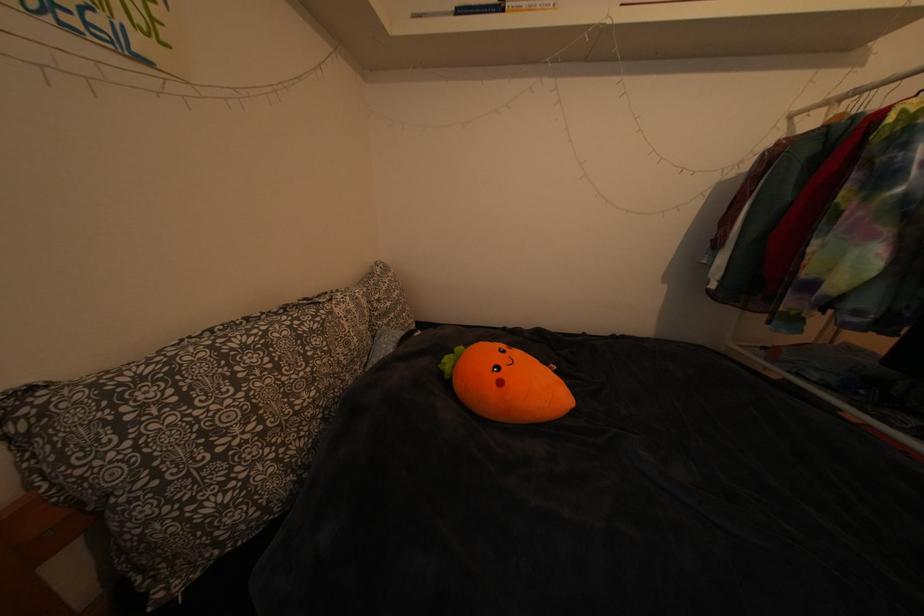
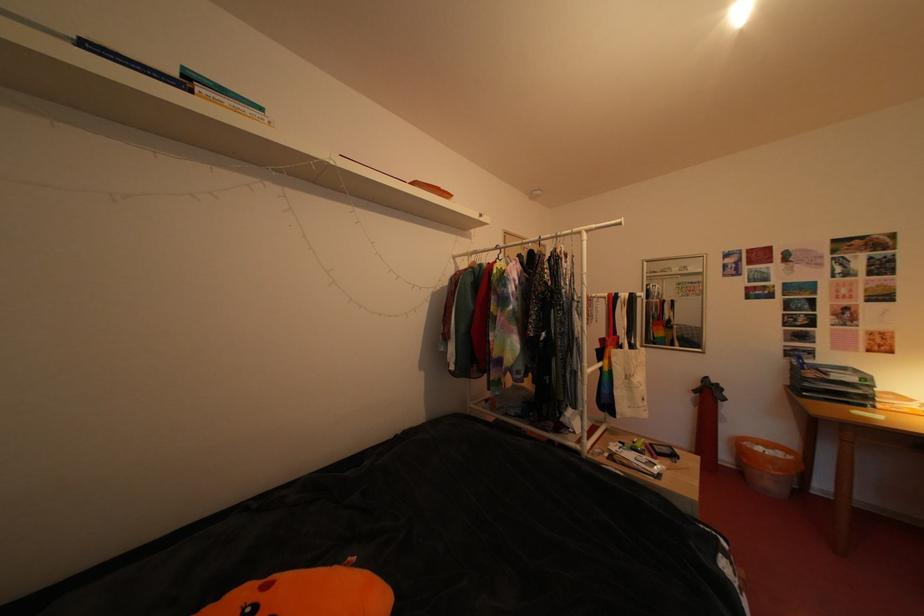
Question: The first image is from the beginning of the video and the second image is from the end. How did the camera likely rotate when shooting the video?

Choices:
 (A) Left
 (B) Right
 (C) Up
 (D) Down

Answer: (B)